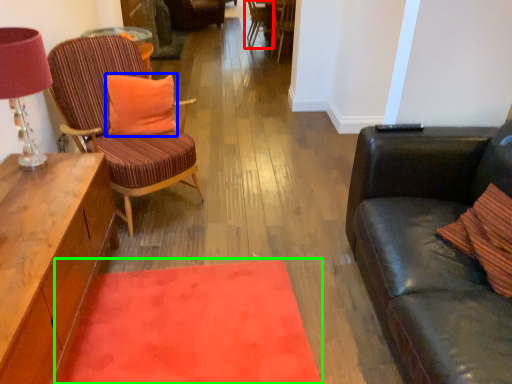
Question: Which object is positioned closest to chair (highlighted by a red box)? Select from pillow (highlighted by a blue box) and mat (highlighted by a green box).

Choices:
 (A) pillow
 (B) mat

Answer: (A)